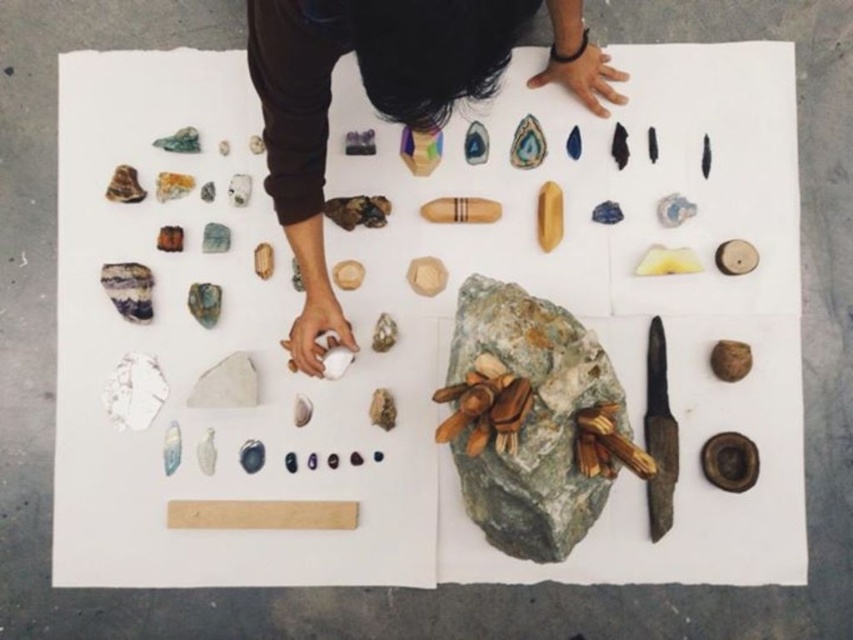
Question: Can you confirm if smooth brown hand at upper center is wider than green rough stone at center?

Choices:
 (A) yes
 (B) no

Answer: (A)

Question: Which of the following is the farthest from the observer?

Choices:
 (A) smooth brown hand at upper center
 (B) green rough stone at center

Answer: (B)

Question: Which point is closer to the camera taking this photo?

Choices:
 (A) (618, 436)
 (B) (625, 77)

Answer: (A)

Question: Does smooth brown hand at upper center have a larger size compared to green rough stone at center?

Choices:
 (A) yes
 (B) no

Answer: (A)

Question: Is smooth brown hand at upper center wider than green rough stone at center?

Choices:
 (A) yes
 (B) no

Answer: (A)